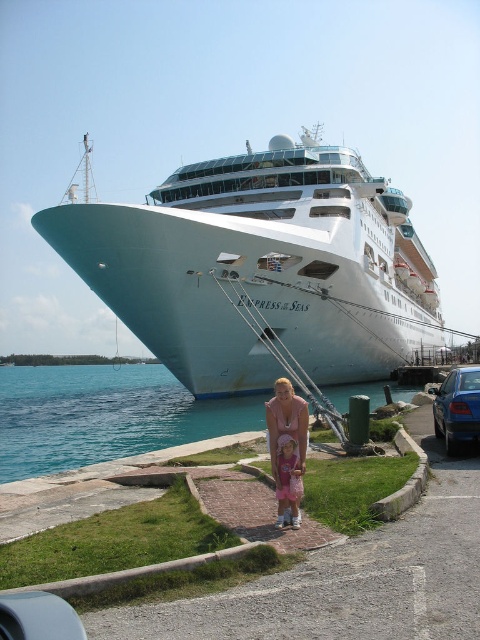
Question: Considering the relative positions of blue water at lower left and matte pink dress at center in the image provided, where is blue water at lower left located with respect to matte pink dress at center?

Choices:
 (A) right
 (B) left

Answer: (B)

Question: Considering the relative positions of blue water at lower left and pink fabric dress at center in the image provided, where is blue water at lower left located with respect to pink fabric dress at center?

Choices:
 (A) left
 (B) right

Answer: (A)

Question: Based on their relative distances, which object is farther from the white glossy cruise ship at center?

Choices:
 (A) blue water at lower left
 (B) pink fabric dress at center
 (C) blue metallic car at lower right
 (D) matte pink dress at center

Answer: (D)

Question: Estimate the real-world distances between objects in this image. Which object is farther from the blue metallic car at lower right?

Choices:
 (A) matte pink dress at center
 (B) blue water at lower left
 (C) white glossy cruise ship at center
 (D) pink fabric dress at center

Answer: (B)

Question: Where is white glossy cruise ship at center located in relation to pink fabric dress at center in the image?

Choices:
 (A) right
 (B) left

Answer: (A)

Question: Estimate the real-world distances between objects in this image. Which object is farther from the white glossy cruise ship at center?

Choices:
 (A) matte pink dress at center
 (B) blue water at lower left

Answer: (A)